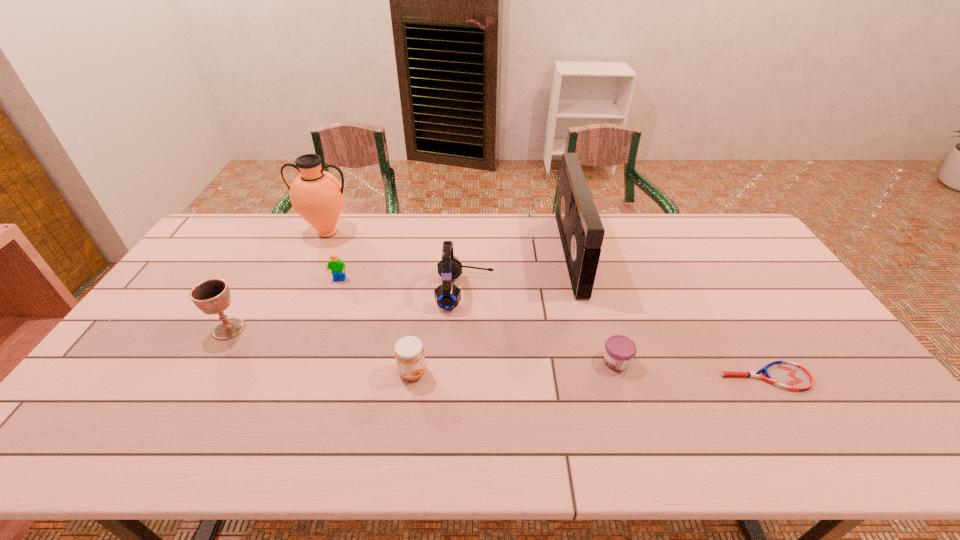
Locate an element on the screen. the right jam is located at coordinates (619, 350).

Identify the location of the rightmost object. (788, 375).

Locate an element on the screen. This screenshot has width=960, height=540. the shortest object is located at coordinates (788, 375).

At what (x,y) coordinates should I click in order to perform the action: click on vacant space situated 0.270m on the right of the pitcher. Please return your answer as a coordinate pair (x, y). This screenshot has height=540, width=960. Looking at the image, I should click on (429, 232).

Where is `vacant space located 0.250m on the front side of the videotape`? vacant space located 0.250m on the front side of the videotape is located at coordinates (492, 253).

Where is `blank space located on the front side of the videotape`? This screenshot has height=540, width=960. blank space located on the front side of the videotape is located at coordinates (448, 253).

The width and height of the screenshot is (960, 540). I want to click on vacant space located on the front side of the videotape, so click(520, 253).

Find the location of `blank space located 0.260m on the ear cushions of the sixth shortest object`. blank space located 0.260m on the ear cushions of the sixth shortest object is located at coordinates (578, 292).

The image size is (960, 540). I want to click on vacant position located on the front of the chalice, so click(x=181, y=410).

Find the location of a particular element. This screenshot has width=960, height=540. free space located on the face of the Lego is located at coordinates [x=329, y=309].